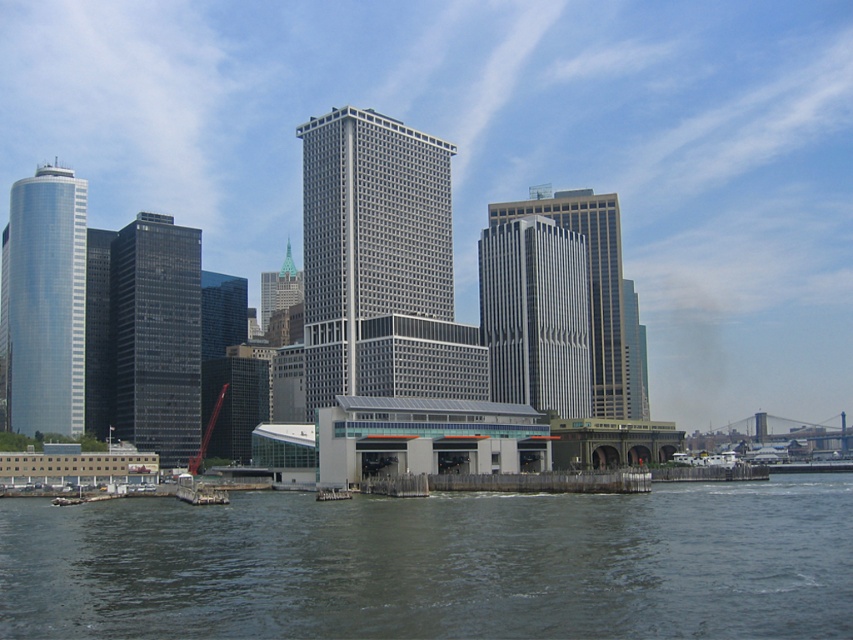
Does gray metallic skyscraper at center have a greater height compared to shiny glass skyscraper at left?

Yes, gray metallic skyscraper at center is taller than shiny glass skyscraper at left.

Who is more distant from viewer, (316, 189) or (49, 380)?

Positioned behind is point (49, 380).

Locate an element on the screen. The width and height of the screenshot is (853, 640). gray metallic skyscraper at center is located at coordinates (370, 234).

Which of these two, gray metallic skyscraper at center or glassy reflective skyscraper at left, stands taller?

Standing taller between the two is gray metallic skyscraper at center.

Can you confirm if gray metallic skyscraper at center is wider than glassy reflective skyscraper at left?

Yes.

Does point (384, 166) lie in front of point (196, 262)?

Yes.

I want to click on gray metallic skyscraper at center, so click(x=370, y=234).

Which is in front, point (140, 285) or point (488, 266)?

Positioned in front is point (140, 285).

Is glassy reflective skyscraper at left further to camera compared to silver glass skyscraper at center?

No, glassy reflective skyscraper at left is in front of silver glass skyscraper at center.

I want to click on glassy reflective skyscraper at left, so click(155, 337).